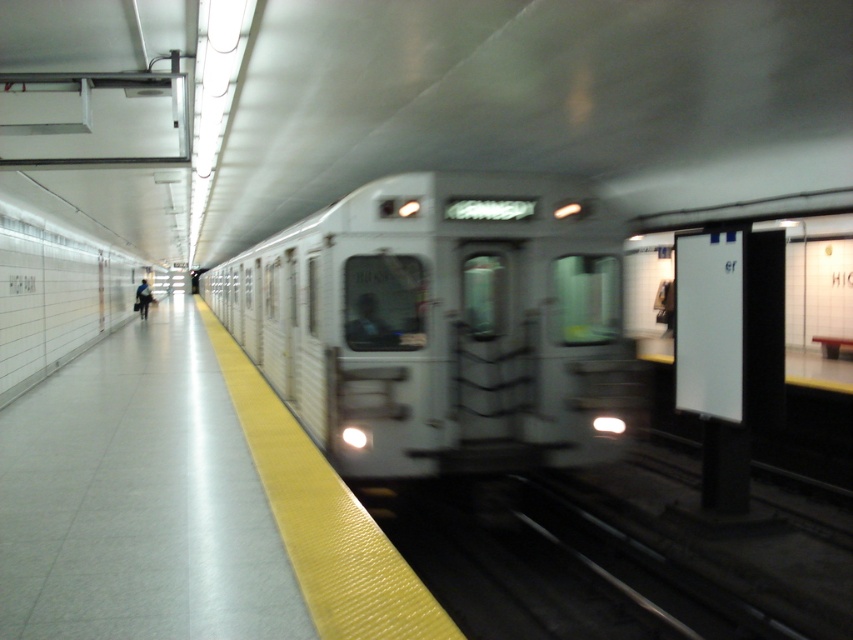
You are standing on the subway platform and want to board the train. You notice the white glossy train at center and the dark blue jacket at left. Which object is bigger in size?

The white glossy train at center is larger in size compared to the dark blue jacket at left.